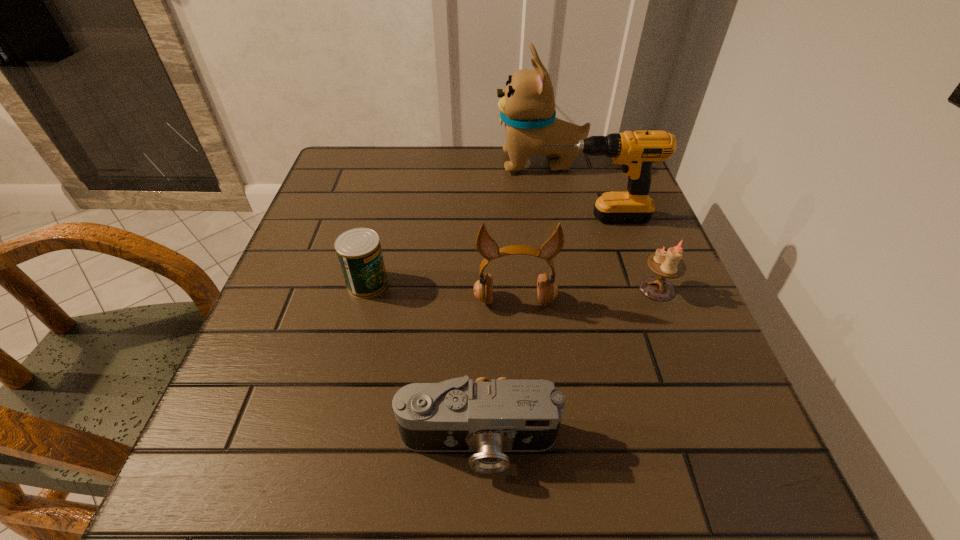
The width and height of the screenshot is (960, 540). I want to click on free space located 0.140m at the tip of the second farthest object, so click(x=474, y=218).

Find the location of `vacant region located 0.210m at the tip of the second farthest object`. vacant region located 0.210m at the tip of the second farthest object is located at coordinates (444, 218).

The image size is (960, 540). Find the location of `free space located at the tip of the second farthest object`. free space located at the tip of the second farthest object is located at coordinates (495, 218).

I want to click on free space located on the front-facing side of the earphone, so click(x=526, y=454).

Locate an element on the screen. free space located on the back of the candle holder is located at coordinates (612, 172).

Find the location of a particular element. The image size is (960, 540). vacant space located 0.360m on the back of the can is located at coordinates (395, 176).

Locate an element on the screen. The width and height of the screenshot is (960, 540). object positioned at the far edge is located at coordinates (527, 106).

Where is `object situated at the near edge`? Image resolution: width=960 pixels, height=540 pixels. object situated at the near edge is located at coordinates (510, 415).

Find the location of a particular element. object at the left edge is located at coordinates (359, 252).

This screenshot has height=540, width=960. I want to click on puppy present at the right edge, so click(527, 106).